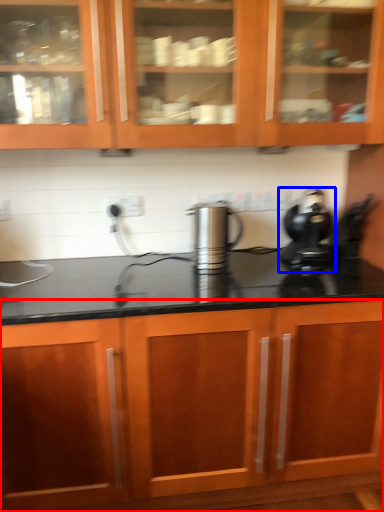
Question: Which object appears closest to the camera in this image, cabinetry (highlighted by a red box) or home appliance (highlighted by a blue box)?

Choices:
 (A) cabinetry
 (B) home appliance

Answer: (A)